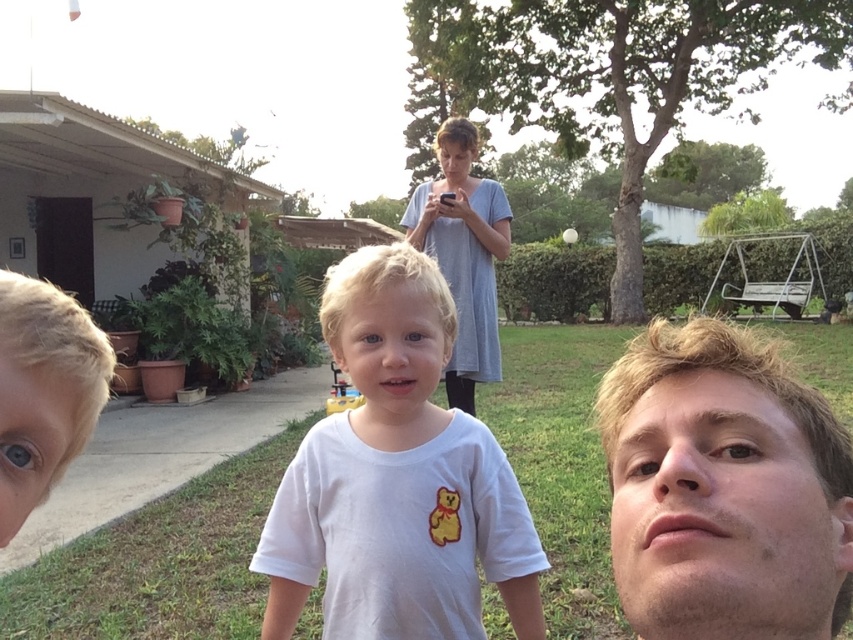
Is white matte t-shirt at center above gray fabric dress at upper center?

No, white matte t-shirt at center is not above gray fabric dress at upper center.

Does point (416, 488) lie in front of point (427, 188)?

Yes, it is in front of point (427, 188).

Measure the distance between point (416, 337) and camera.

The distance of point (416, 337) from camera is 1.21 meters.

At what (x,y) coordinates should I click in order to perform the action: click on white matte t-shirt at center. Please return your answer as a coordinate pair (x, y). The height and width of the screenshot is (640, 853). Looking at the image, I should click on (396, 477).

Who is more forward, (76,355) or (454,211)?

Point (76,355)

Is point (96, 364) in front of point (462, 372)?

Yes.

The image size is (853, 640). I want to click on blonde hair at left, so click(44, 390).

Can you confirm if smooth skin face at lower right is wider than blonde hair at left?

Yes, smooth skin face at lower right is wider than blonde hair at left.

Is smooth skin face at lower right bigger than blonde hair at left?

Indeed, smooth skin face at lower right has a larger size compared to blonde hair at left.

Locate an element on the screen. This screenshot has width=853, height=640. smooth skin face at lower right is located at coordinates (724, 486).